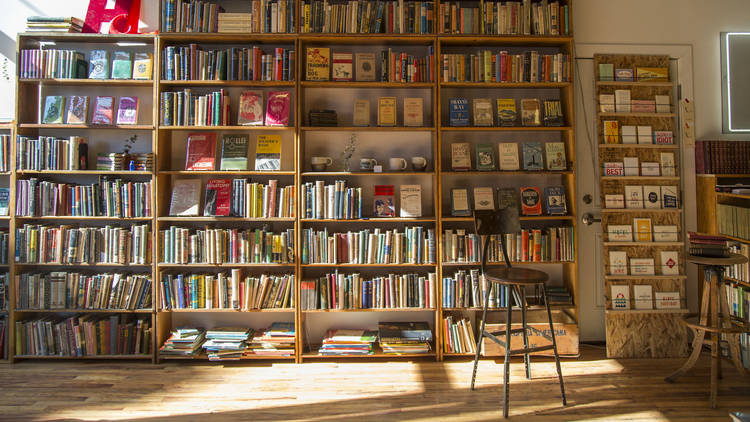
Where is `four black legs on stool`? The image size is (750, 422). four black legs on stool is located at coordinates (506, 353), (480, 338), (518, 318), (544, 323).